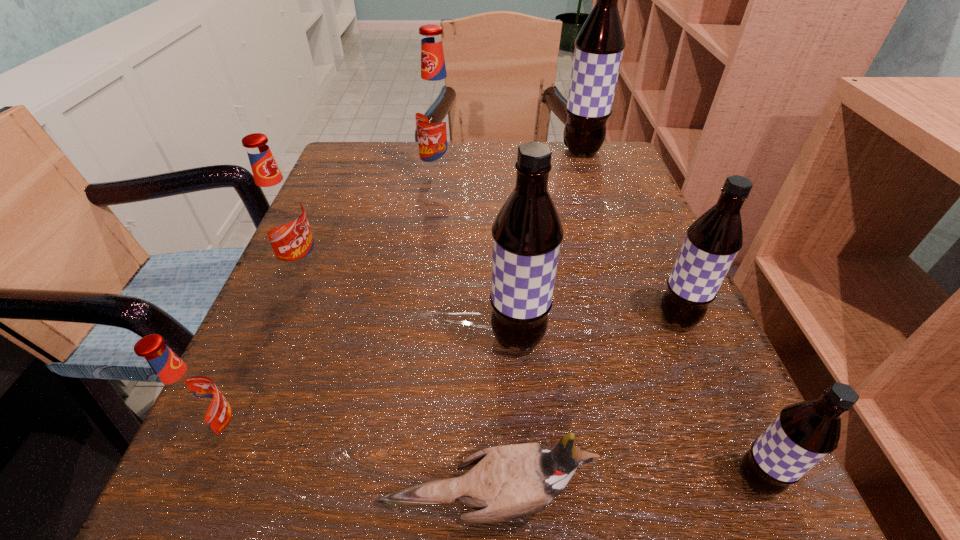
Locate an element on the screen. This screenshot has width=960, height=540. the farthest brown root beer is located at coordinates (599, 46).

Find the location of a particular element. The image size is (960, 540). the farthest object is located at coordinates (599, 46).

Locate an element on the screen. The width and height of the screenshot is (960, 540). the second farthest root beer is located at coordinates (436, 114).

Find the location of `the fifth root beer from right to left`. the fifth root beer from right to left is located at coordinates (436, 114).

In order to click on the leftmost brown root beer in this screenshot , I will do `click(527, 233)`.

Locate an element on the screen. The width and height of the screenshot is (960, 540). the fourth root beer from right to left is located at coordinates (527, 233).

This screenshot has width=960, height=540. What are the coordinates of `the fifth nearest root beer` in the screenshot? It's located at (282, 216).

At what (x,y) coordinates should I click in order to perform the action: click on the second farthest red root beer. Please return your answer as a coordinate pair (x, y). The width and height of the screenshot is (960, 540). Looking at the image, I should click on (282, 216).

Where is `the second smallest brown root beer`? the second smallest brown root beer is located at coordinates (713, 240).

The width and height of the screenshot is (960, 540). In order to click on the second nearest root beer in this screenshot , I will do `click(190, 397)`.